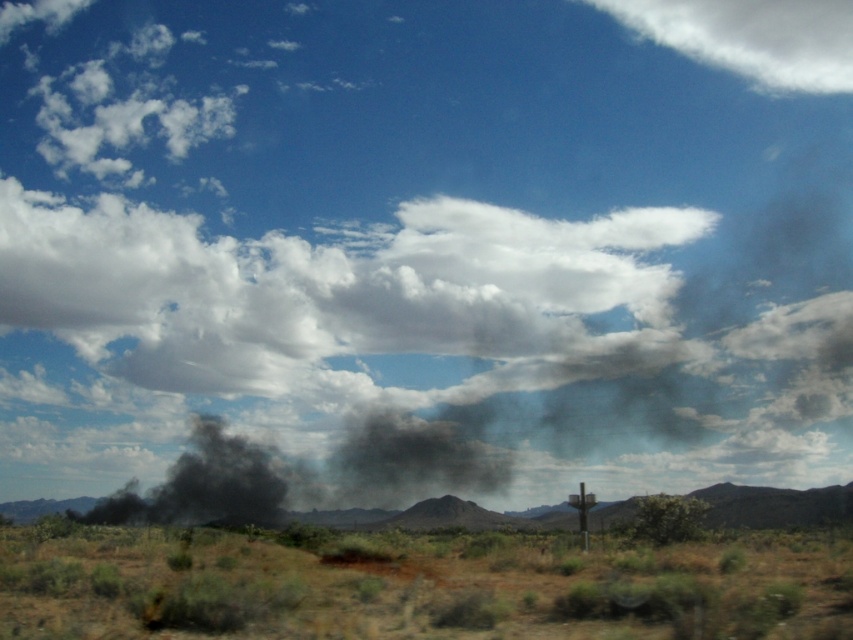
In the scene shown: You are a hiker trying to navigate through the desert. You see the brown dry grass at lower left and the white fluffy cloud at upper center. How far apart are these two landmarks?

The brown dry grass at lower left is 59.44 meters from the white fluffy cloud at upper center.

You are a firefighter assessing the scene. You see the black matte smoke at center and the black smoke at center. Which one is closer to you?

The black smoke at center is closer to you because the distance between them is 33.02 feet, so the black smoke at center is nearer than the black matte smoke at center.

You are standing in the desert and see the brown dry grass at lower left and the white fluffy cloud at upper center. Which object is closer to you?

The brown dry grass at lower left is closer because it is in front of the white fluffy cloud at upper center.